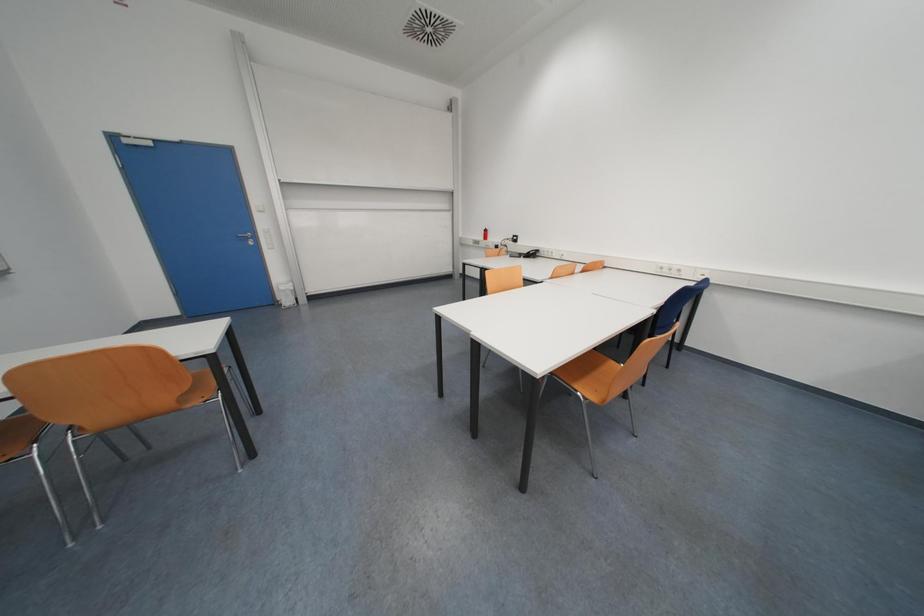
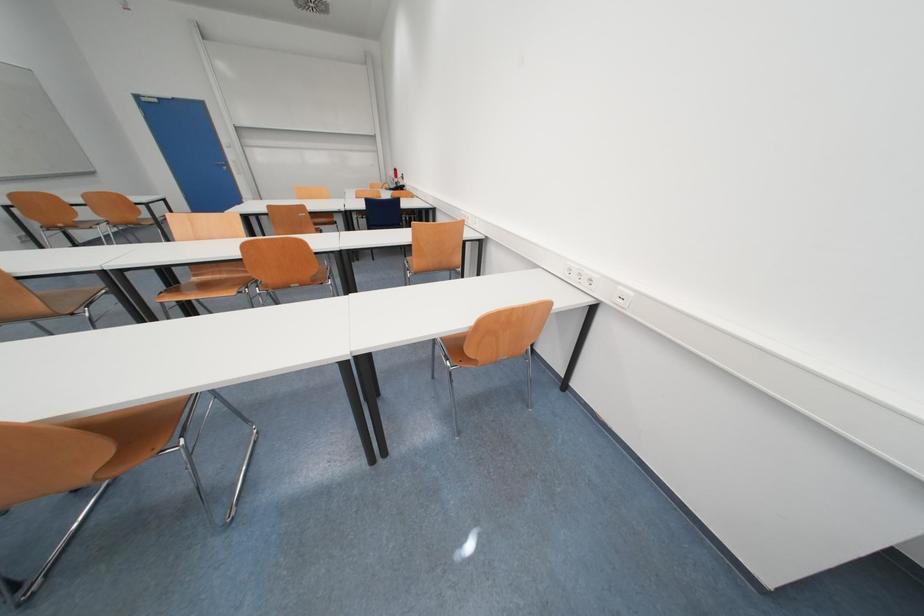
In a continuous first-person perspective shot, in which direction is the camera moving?

The movement direction of the cameraman is right, backward.